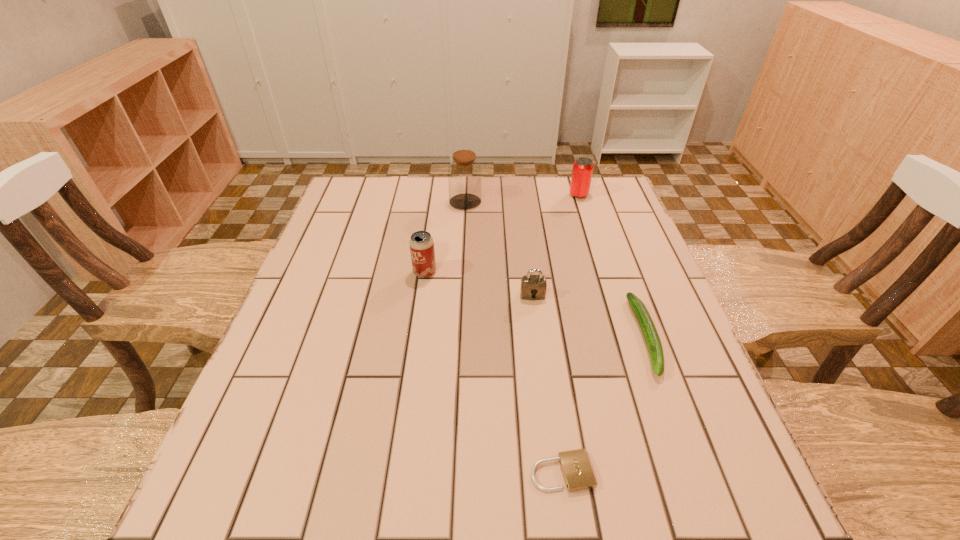
What are the coordinates of `jar` in the screenshot? It's located at (464, 173).

Where is `the second object from left to right`? the second object from left to right is located at coordinates click(464, 173).

Locate an element on the screen. The height and width of the screenshot is (540, 960). can is located at coordinates (582, 171).

The height and width of the screenshot is (540, 960). What are the coordinates of `beer can` in the screenshot? It's located at (421, 243).

What are the coordinates of `the third farthest object` in the screenshot? It's located at (421, 243).

Where is `the fourth tallest object`? The width and height of the screenshot is (960, 540). the fourth tallest object is located at coordinates (533, 287).

Locate an element on the screen. The height and width of the screenshot is (540, 960). the taller padlock is located at coordinates 533,287.

Where is `the rightmost object`? the rightmost object is located at coordinates (646, 324).

I want to click on the fifth tallest object, so click(646, 324).

Locate an element on the screen. The height and width of the screenshot is (540, 960). the shorter padlock is located at coordinates (575, 465).